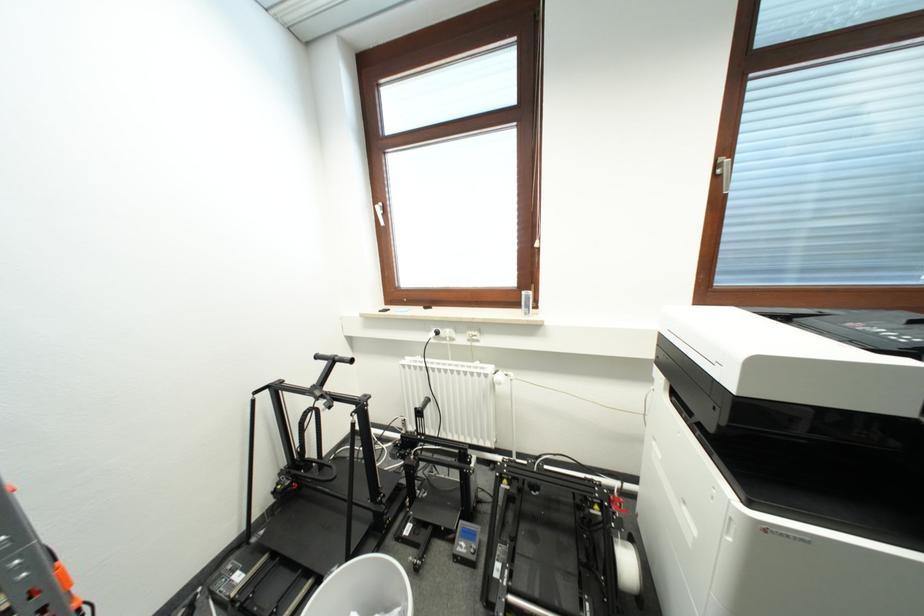
What do you see at coordinates (500, 377) in the screenshot? The height and width of the screenshot is (616, 924). I see `a silver control knob` at bounding box center [500, 377].